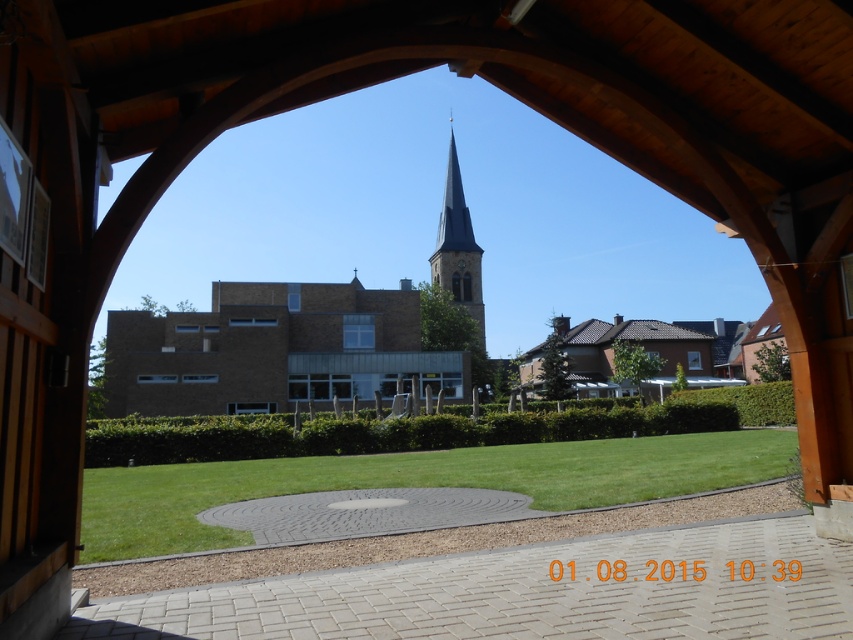
Question: Which object is the farthest from the green grass at center?

Choices:
 (A) smooth gray steeple at center
 (B) brown brick church at center

Answer: (A)

Question: Does green grass at center appear under smooth gray steeple at center?

Choices:
 (A) yes
 (B) no

Answer: (A)

Question: Which of these objects is positioned closest to the smooth gray steeple at center?

Choices:
 (A) green grass at center
 (B) brown brick church at center

Answer: (B)

Question: Is brown brick church at center bigger than green grass at center?

Choices:
 (A) yes
 (B) no

Answer: (A)

Question: Does green grass at center have a greater width compared to smooth gray steeple at center?

Choices:
 (A) no
 (B) yes

Answer: (B)

Question: Which is farther from the smooth gray steeple at center?

Choices:
 (A) brown brick church at center
 (B) green grass at center

Answer: (B)